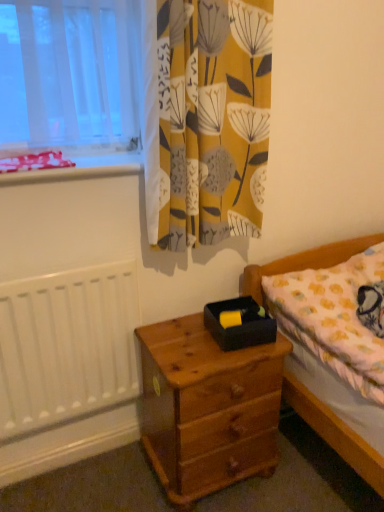
Identify the location of black matte box at center. The height and width of the screenshot is (512, 384). (240, 325).

Locate an element on the screen. The image size is (384, 512). wooden bed at lower right is located at coordinates (335, 432).

In the scene shown: What is the approximate height of white painted radiator at left?

white painted radiator at left is 25.09 inches in height.

What do you see at coordinates (67, 345) in the screenshot?
I see `white painted radiator at left` at bounding box center [67, 345].

Find the location of a particular element. wooden nightstand at lower center is located at coordinates (207, 408).

Locate an element on the screen. black matte box at center is located at coordinates (240, 325).

Would you say wooden nightstand at lower center is a long distance from wooden bed at lower right?

wooden nightstand at lower center is actually quite close to wooden bed at lower right.

Considering the relative positions of wooden nightstand at lower center and wooden bed at lower right in the image provided, is wooden nightstand at lower center to the left or to the right of wooden bed at lower right?

wooden nightstand at lower center is to the left of wooden bed at lower right.

Which is correct: wooden nightstand at lower center is inside wooden bed at lower right, or outside of it?

wooden nightstand at lower center is outside wooden bed at lower right.

The width and height of the screenshot is (384, 512). Find the location of `bed on the right of wooden nightstand at lower center`. bed on the right of wooden nightstand at lower center is located at coordinates pos(335,432).

Is the position of black matte box at center less distant than that of yellow fabric curtain at upper center?

No, it is behind yellow fabric curtain at upper center.

From a real-world perspective, is black matte box at center positioned over yellow fabric curtain at upper center based on gravity?

No, from a real-world perspective, black matte box at center is not on top of yellow fabric curtain at upper center.

Looking at this image, is black matte box at center to the right of yellow fabric curtain at upper center from the viewer's perspective?

Correct, you'll find black matte box at center to the right of yellow fabric curtain at upper center.

Is black matte box at center situated inside yellow fabric curtain at upper center or outside?

black matte box at center exists outside the volume of yellow fabric curtain at upper center.

Locate an element on the screen. The height and width of the screenshot is (512, 384). curtain in front of the wooden bed at lower right is located at coordinates (213, 119).

Is yellow fabric curtain at upper center positioned in front of wooden bed at lower right?

Yes, yellow fabric curtain at upper center is in front of wooden bed at lower right.

Can you confirm if yellow fabric curtain at upper center is wider than wooden bed at lower right?

Incorrect, the width of yellow fabric curtain at upper center does not surpass that of wooden bed at lower right.

How different are the orientations of white painted radiator at left and red plastic tray at upper left in degrees?

They differ by 0.171 degrees in their facing directions.

Which is in front, white painted radiator at left or red plastic tray at upper left?

white painted radiator at left.

Can you confirm if white painted radiator at left is bigger than red plastic tray at upper left?

Correct, white painted radiator at left is larger in size than red plastic tray at upper left.

Is red plastic tray at upper left surrounded by white painted radiator at left?

Actually, red plastic tray at upper left is outside white painted radiator at left.

Who is bigger, red plastic tray at upper left or wooden nightstand at lower center?

wooden nightstand at lower center.

From the image's perspective, which one is positioned higher, red plastic tray at upper left or wooden nightstand at lower center?

red plastic tray at upper left is shown above in the image.

In the image, is red plastic tray at upper left positioned in front of or behind wooden nightstand at lower center?

red plastic tray at upper left is positioned farther from the viewer than wooden nightstand at lower center.

Which is more distant, [103,170] or [173,492]?

The point [173,492] is more distant.

Which point is more forward, (203, 334) or (12, 184)?

Positioned in front is point (12, 184).

This screenshot has height=512, width=384. I want to click on window sill above the wooden nightstand at lower center (from the image's perspective), so click(x=77, y=170).

Which is in front, wooden nightstand at lower center or red plastic tray at upper left?

wooden nightstand at lower center is more forward.

From the image's perspective, is yellow fabric curtain at upper center located above or below black matte box at center?

yellow fabric curtain at upper center is situated higher than black matte box at center in the image.

Is yellow fabric curtain at upper center far from black matte box at center?

No.

Does yellow fabric curtain at upper center have a larger size compared to black matte box at center?

Indeed, yellow fabric curtain at upper center has a larger size compared to black matte box at center.

Which is in front, yellow fabric curtain at upper center or black matte box at center?

yellow fabric curtain at upper center is closer to the camera.

You are a GUI agent. You are given a task and a screenshot of the screen. Output one action in this format:
    pyautogui.click(x=<x>, y=<y>)
    Task: Click on the bed in front of the wooden nightstand at lower center
    
    Given the screenshot: What is the action you would take?
    pyautogui.click(x=335, y=432)

At what (x,y) coordinates should I click in order to perform the action: click on curtain to the left of black matte box at center. Please return your answer as a coordinate pair (x, y). This screenshot has width=384, height=512. Looking at the image, I should click on (213, 119).

Which object lies further to the anchor point yellow fabric curtain at upper center, red plastic tray at upper left or white painted radiator at left?

white painted radiator at left is positioned further to the anchor yellow fabric curtain at upper center.

In the scene shown: Which object lies further to the anchor point red plastic tray at upper left, yellow fabric curtain at upper center or black matte box at center?

black matte box at center.

Considering their positions, is wooden nightstand at lower center positioned closer to wooden bed at lower right than black matte box at center?

The object closer to wooden bed at lower right is wooden nightstand at lower center.

Considering their positions, is wooden nightstand at lower center positioned further to wooden bed at lower right than white painted radiator at left?

white painted radiator at left is further to wooden bed at lower right.

Which object lies nearer to the anchor point white painted radiator at left, wooden nightstand at lower center or black matte box at center?

Based on the image, wooden nightstand at lower center appears to be nearer to white painted radiator at left.

Looking at the image, which one is located further to black matte box at center, yellow fabric curtain at upper center or wooden nightstand at lower center?

Based on the image, yellow fabric curtain at upper center appears to be further to black matte box at center.

Based on their spatial positions, is wooden nightstand at lower center or wooden bed at lower right closer to red plastic tray at upper left?

Based on the image, wooden nightstand at lower center appears to be nearer to red plastic tray at upper left.

Considering their positions, is wooden nightstand at lower center positioned further to red plastic tray at upper left than white painted radiator at left?

wooden nightstand at lower center.

This screenshot has width=384, height=512. I want to click on window sill that lies between yellow fabric curtain at upper center and black matte box at center from top to bottom, so click(x=77, y=170).

Identify the location of box between yellow fabric curtain at upper center and wooden nightstand at lower center in the up-down direction. Image resolution: width=384 pixels, height=512 pixels. (240, 325).

This screenshot has height=512, width=384. I want to click on box situated between white painted radiator at left and wooden bed at lower right from left to right, so click(x=240, y=325).

Locate an element on the screen. This screenshot has width=384, height=512. window sill between yellow fabric curtain at upper center and wooden nightstand at lower center vertically is located at coordinates (77, 170).